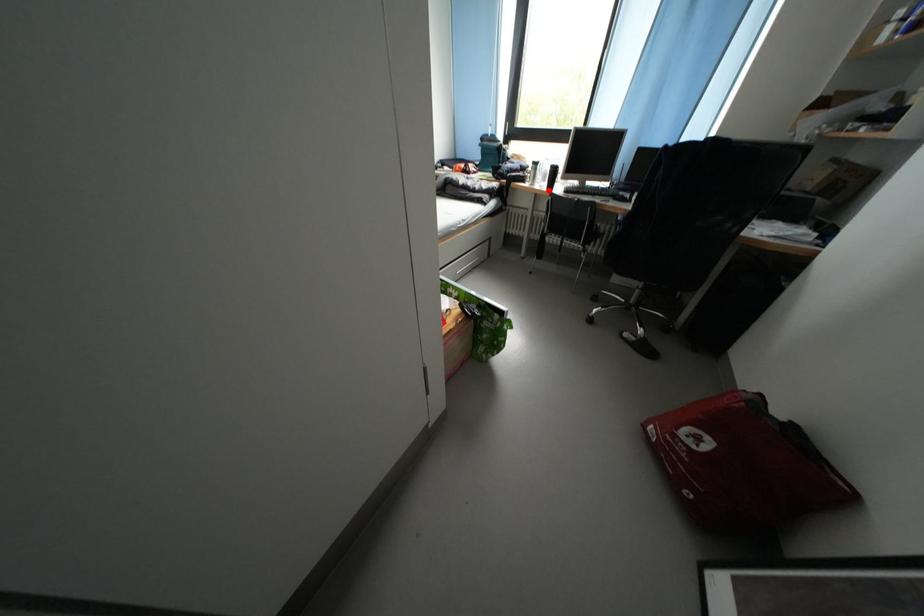
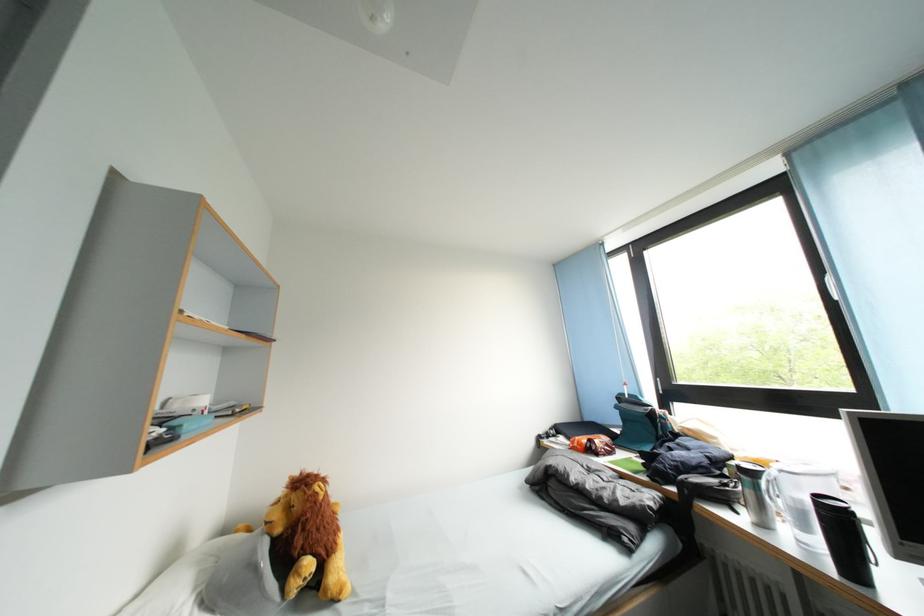
Where in the second image is the point corresponding to the highlighted location from the first image?

(808, 546)